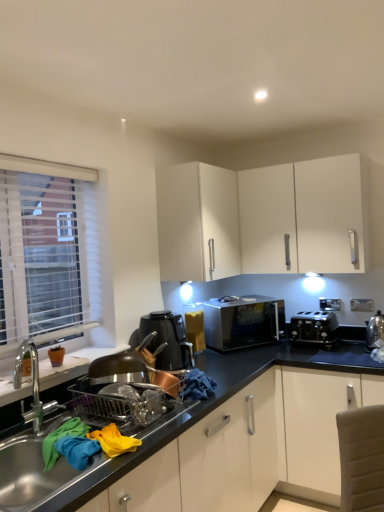
Measure the distance between point (250,302) and camera.

Point (250,302) and camera are 2.95 meters apart from each other.

You are a GUI agent. You are given a task and a screenshot of the screen. Output one action in this format:
    pyautogui.click(x=<x>, y=<y>)
    Task: Click on the satin silver microwave at center
    
    Given the screenshot: What is the action you would take?
    pyautogui.click(x=243, y=322)

Locate an element on the screen. metallic stainless steel sink at lower left is located at coordinates (209, 442).

The height and width of the screenshot is (512, 384). Find the location of `white blinds at left`. white blinds at left is located at coordinates (45, 248).

The height and width of the screenshot is (512, 384). I want to click on white matte cabinet at upper center, so (x=197, y=221).

Does black plastic toaster at lower right, which is the second appliance in front-to-back order, turn towards satin silver kettle at right, acting as the 1th appliance starting from the right?

No, black plastic toaster at lower right, which is the second appliance in front-to-back order, is not oriented towards satin silver kettle at right, acting as the 1th appliance starting from the right.

Is black plastic toaster at lower right, which is the first appliance in left-to-right order, smaller than satin silver kettle at right, the first appliance when ordered from front to back?

Incorrect, black plastic toaster at lower right, which is the first appliance in left-to-right order, is not smaller in size than satin silver kettle at right, the first appliance when ordered from front to back.

Would you say black plastic toaster at lower right, which is the second appliance in front-to-back order, is a long distance from satin silver kettle at right, which ranks as the second appliance in back-to-front order?

No, black plastic toaster at lower right, which is the second appliance in front-to-back order, is in close proximity to satin silver kettle at right, which ranks as the second appliance in back-to-front order.

From a real-world perspective, which object rests below the other?

In real-world perspective, black plastic toaster at lower right, which is the first appliance in left-to-right order, is lower.

Is white matte cabinet at upper center in contact with black plastic toaster at lower right, placed as the 2th appliance when sorted from right to left?

They are not placed beside each other.

Where is `cabinetry on the left of black plastic toaster at lower right, which is the first appliance in left-to-right order`? The image size is (384, 512). cabinetry on the left of black plastic toaster at lower right, which is the first appliance in left-to-right order is located at coordinates (197, 221).

From a real-world perspective, is white matte cabinet at upper center positioned over black plastic toaster at lower right, the first appliance when ordered from back to front, based on gravity?

Yes.

Is white matte cabinet at upper center positioned beyond the bounds of black plastic toaster at lower right, which is the second appliance in front-to-back order?

Yes, white matte cabinet at upper center is located beyond the bounds of black plastic toaster at lower right, which is the second appliance in front-to-back order.

Would you say black plastic toaster at lower right, placed as the 2th appliance when sorted from right to left, is inside or outside white blinds at left?

The correct answer is: outside.

Who is shorter, black plastic toaster at lower right, which is the second appliance in front-to-back order, or white blinds at left?

black plastic toaster at lower right, which is the second appliance in front-to-back order, is shorter.

Looking at this image, which object is positioned more to the right, black plastic toaster at lower right, the first appliance when ordered from back to front, or white blinds at left?

Positioned to the right is black plastic toaster at lower right, the first appliance when ordered from back to front.

Which is more to the left, black plastic kettle at center or black plastic toaster at lower right, placed as the 2th appliance when sorted from right to left?

black plastic kettle at center is more to the left.

Locate an element on the screen. appliance that is the 2nd object directly below the black plastic kettle at center (from a real-world perspective) is located at coordinates (314, 329).

Is point (183, 329) behind point (298, 329)?

No, it is in front of (298, 329).

Considering the sizes of objects satin silver kettle at right, which is the 2th appliance in left-to-right order, and white matte cabinet at upper center in the image provided, who is bigger, satin silver kettle at right, which is the 2th appliance in left-to-right order, or white matte cabinet at upper center?

white matte cabinet at upper center.

From the image's perspective, is satin silver kettle at right, the first appliance when ordered from front to back, above or below white matte cabinet at upper center?

Clearly, from the image's perspective, satin silver kettle at right, the first appliance when ordered from front to back, is below white matte cabinet at upper center.

Can you tell me how much satin silver kettle at right, acting as the 1th appliance starting from the right, and white matte cabinet at upper center differ in facing direction?

The angular difference between satin silver kettle at right, acting as the 1th appliance starting from the right, and white matte cabinet at upper center is 84.8 degrees.

Image resolution: width=384 pixels, height=512 pixels. I want to click on microwave oven that is above the metallic stainless steel sink at lower left (from the image's perspective), so click(243, 322).

Can you see metallic stainless steel sink at lower left touching satin silver microwave at center?

No, metallic stainless steel sink at lower left is not with satin silver microwave at center.

Based on the photo, considering the relative positions of metallic stainless steel sink at lower left and satin silver microwave at center in the image provided, is metallic stainless steel sink at lower left in front of satin silver microwave at center?

Yes, the depth of metallic stainless steel sink at lower left is less than that of satin silver microwave at center.

Based on the photo, from a real-world perspective, which object rests below the other?

From a 3D spatial view, metallic stainless steel sink at lower left is below.

Can you tell me how much white blinds at left and black plastic toaster at lower right, the first appliance when ordered from back to front, differ in facing direction?

The angle between the facing direction of white blinds at left and the facing direction of black plastic toaster at lower right, the first appliance when ordered from back to front, is 89.5 degrees.

Can you confirm if white blinds at left is wider than black plastic toaster at lower right, which is the first appliance in left-to-right order?

No, white blinds at left is not wider than black plastic toaster at lower right, which is the first appliance in left-to-right order.

Is white blinds at left at the left side of black plastic toaster at lower right, which is the first appliance in left-to-right order?

Indeed, white blinds at left is positioned on the left side of black plastic toaster at lower right, which is the first appliance in left-to-right order.

Locate an element on the screen. This screenshot has height=512, width=384. appliance in front of the black plastic toaster at lower right, which is the first appliance in left-to-right order is located at coordinates (374, 329).

From the image's perspective, count 2nd appliances downward from the white matte cabinet at upper center and point to it. Please provide its 2D coordinates.

[(314, 329)]

When comparing their distances from satin silver microwave at center, does black plastic toaster at lower right, which is the second appliance in front-to-back order, or white blinds at left seem closer?

black plastic toaster at lower right, which is the second appliance in front-to-back order, is positioned closer to the anchor satin silver microwave at center.

Considering their positions, is white blinds at left positioned further to metallic stainless steel sink at lower left than white matte cabinet at upper center?

white blinds at left lies further to metallic stainless steel sink at lower left than the other object.

Which object lies nearer to the anchor point black plastic kettle at center, satin silver kettle at right, acting as the 1th appliance starting from the right, or white blinds at left?

Based on the image, white blinds at left appears to be nearer to black plastic kettle at center.

Which object lies nearer to the anchor point satin silver kettle at right, which is the 2th appliance in left-to-right order, black plastic kettle at center or white blinds at left?

The object closer to satin silver kettle at right, which is the 2th appliance in left-to-right order, is black plastic kettle at center.

In the scene shown: Estimate the real-world distances between objects in this image. Which object is closer to satin silver kettle at right, which ranks as the second appliance in back-to-front order, white matte cabinet at upper center or metallic stainless steel sink at lower left?

metallic stainless steel sink at lower left.

Considering their positions, is satin silver kettle at right, which is the 2th appliance in left-to-right order, positioned further to white matte cabinet at upper center than black plastic kettle at center?

satin silver kettle at right, which is the 2th appliance in left-to-right order, is positioned further to the anchor white matte cabinet at upper center.

Based on their spatial positions, is satin silver microwave at center or black plastic kettle at center closer to white blinds at left?

black plastic kettle at center lies closer to white blinds at left than the other object.

Looking at the image, which one is located further to satin silver kettle at right, acting as the 1th appliance starting from the right, black plastic kettle at center or metallic stainless steel sink at lower left?

The object further to satin silver kettle at right, acting as the 1th appliance starting from the right, is black plastic kettle at center.

You are a GUI agent. You are given a task and a screenshot of the screen. Output one action in this format:
    pyautogui.click(x=<x>, y=<y>)
    Task: Click on the microwave oven between white blinds at left and satin silver kettle at right, the first appliance when ordered from front to back
    
    Given the screenshot: What is the action you would take?
    pyautogui.click(x=243, y=322)

Where is `countertop between white blinds at left and black plastic toaster at lower right, the first appliance when ordered from back to front, from left to right`? Image resolution: width=384 pixels, height=512 pixels. countertop between white blinds at left and black plastic toaster at lower right, the first appliance when ordered from back to front, from left to right is located at coordinates (209, 442).

Where is `cabinetry between metallic stainless steel sink at lower left and black plastic toaster at lower right, which is the second appliance in front-to-back order, along the z-axis`? This screenshot has height=512, width=384. cabinetry between metallic stainless steel sink at lower left and black plastic toaster at lower right, which is the second appliance in front-to-back order, along the z-axis is located at coordinates (197, 221).

This screenshot has height=512, width=384. Identify the location of cabinetry located between metallic stainless steel sink at lower left and satin silver microwave at center in the depth direction. (197, 221).